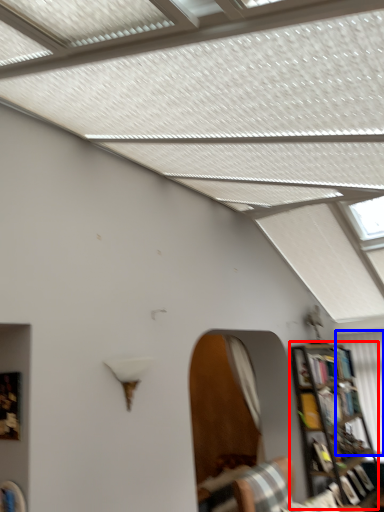
Question: Which point is further to the camera, bookcase (highlighted by a red box) or curtain (highlighted by a blue box)?

Choices:
 (A) bookcase
 (B) curtain

Answer: (B)